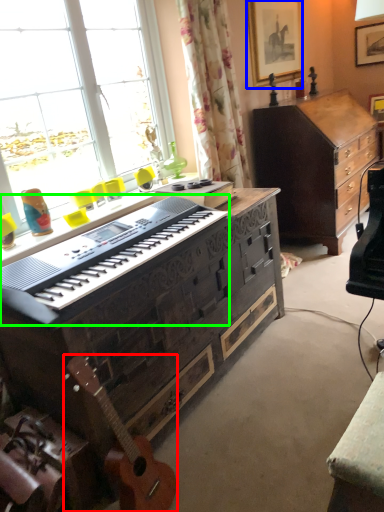
Question: Which is nearer to the guitar (highlighted by a red box)? picture frame (highlighted by a blue box) or piano (highlighted by a green box).

Choices:
 (A) picture frame
 (B) piano

Answer: (B)